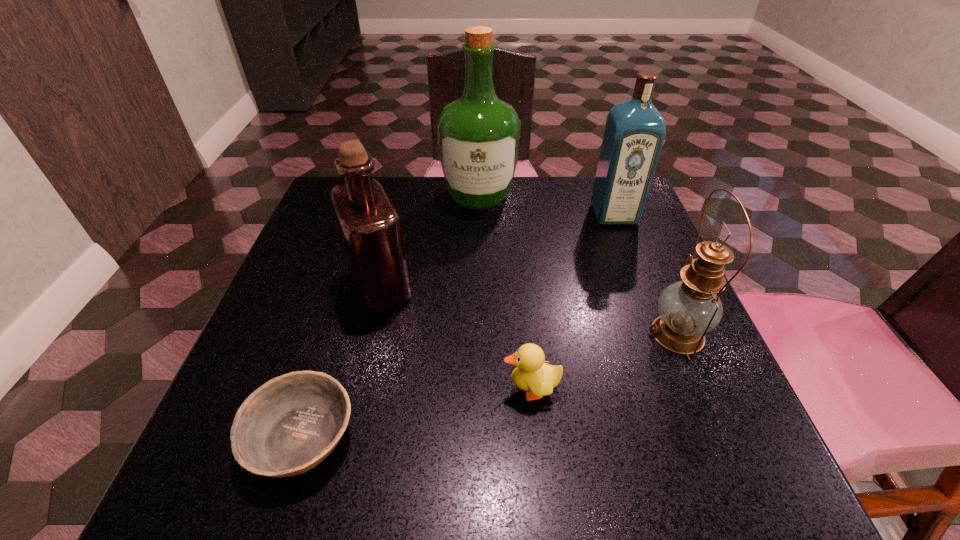
Locate an element on the screen. The image size is (960, 540). the second liquor from right to left is located at coordinates (478, 134).

Image resolution: width=960 pixels, height=540 pixels. I want to click on the tallest liquor, so click(x=478, y=134).

Where is `the rightmost liquor`? the rightmost liquor is located at coordinates (635, 130).

The image size is (960, 540). Identify the location of the nearest liquor. (370, 229).

At what (x,y) coordinates should I click in order to perform the action: click on oil lamp. Please return your answer as a coordinate pair (x, y). Looking at the image, I should click on (689, 309).

At what (x,y) coordinates should I click in order to perform the action: click on the second shortest object. Please return your answer as a coordinate pair (x, y). The width and height of the screenshot is (960, 540). Looking at the image, I should click on (532, 375).

The height and width of the screenshot is (540, 960). Identify the location of bowl. [x=286, y=427].

I want to click on vacant region located 0.230m on the front-facing side of the tallest liquor, so click(479, 285).

Image resolution: width=960 pixels, height=540 pixels. Find the location of `free spot located on the flat label side of the rightmost liquor`. free spot located on the flat label side of the rightmost liquor is located at coordinates (646, 300).

This screenshot has height=540, width=960. Identify the location of vacant region located on the front of the nearest liquor. (359, 376).